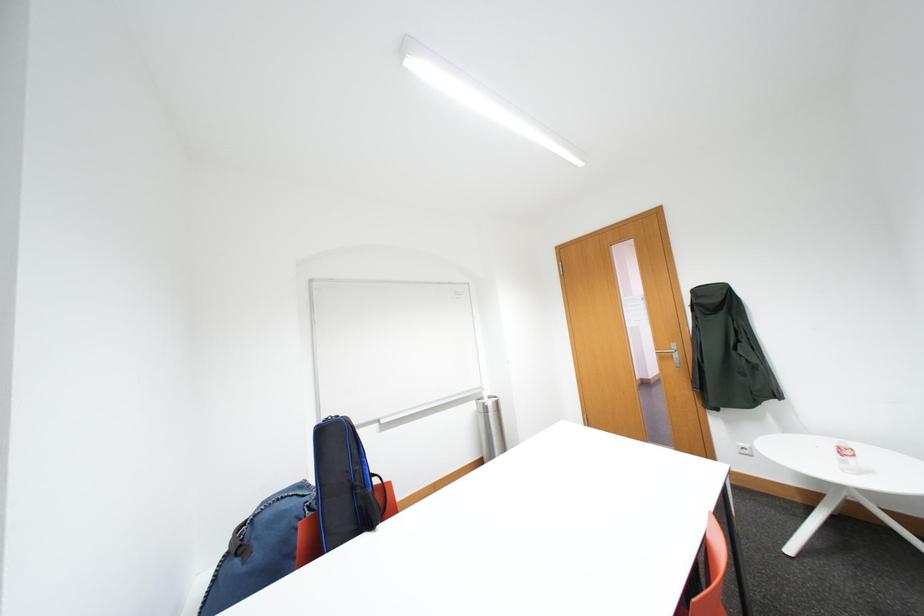
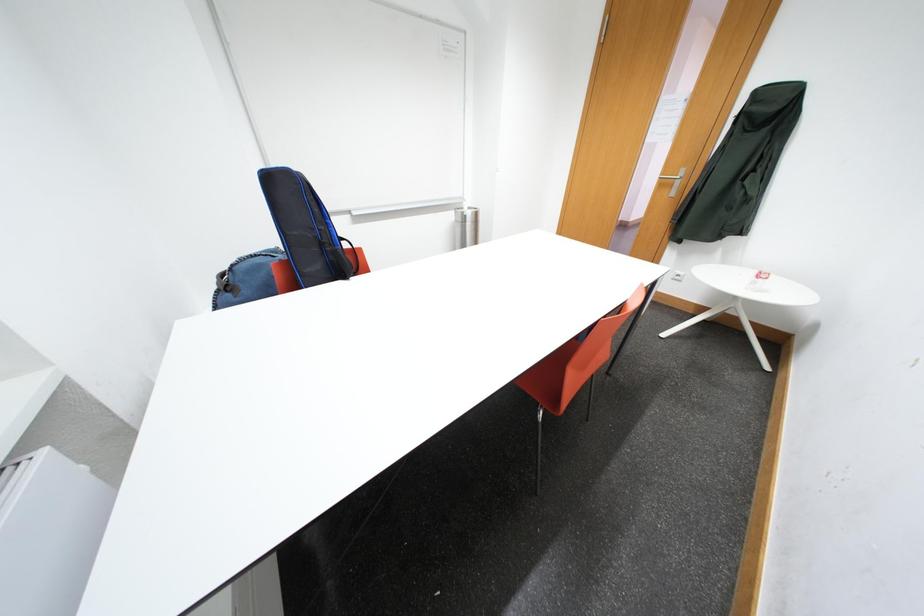
Question: The images are taken continuously from a first-person perspective. In which direction is your viewpoint rotating?

Choices:
 (A) Left
 (B) Right
 (C) Up
 (D) Down

Answer: (D)